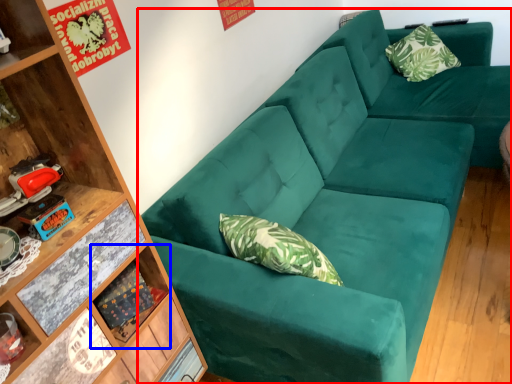
Question: Which of the following is the farthest to the observer, studio couch (highlighted by a red box) or shelf (highlighted by a blue box)?

Choices:
 (A) studio couch
 (B) shelf

Answer: (B)